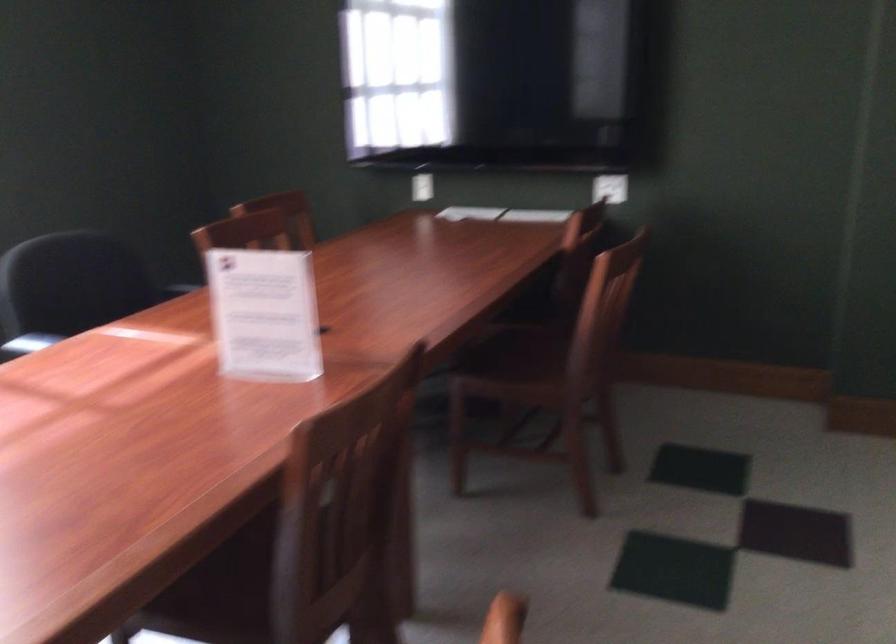
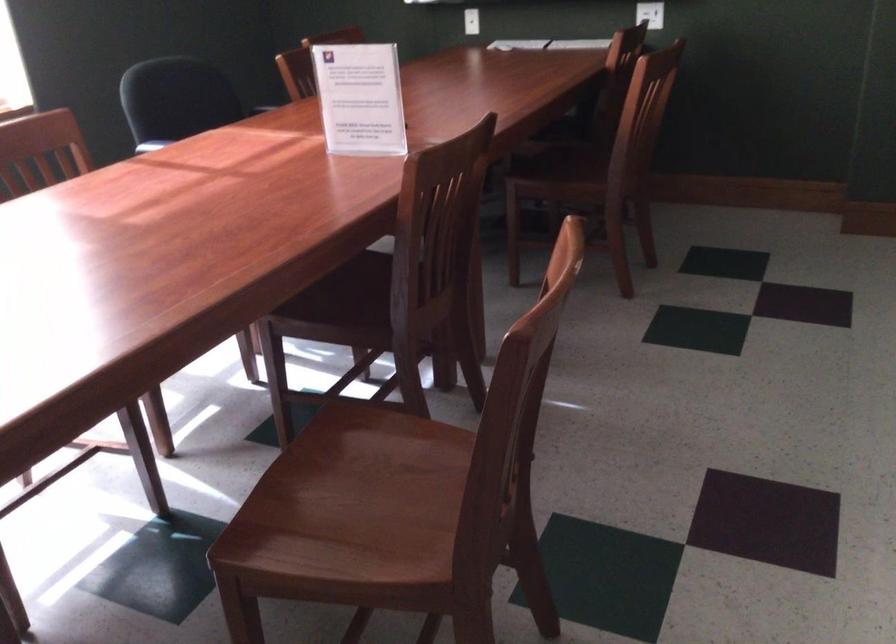
The point at (264,314) is marked in the first image. Where is the corresponding point in the second image?

(359, 98)